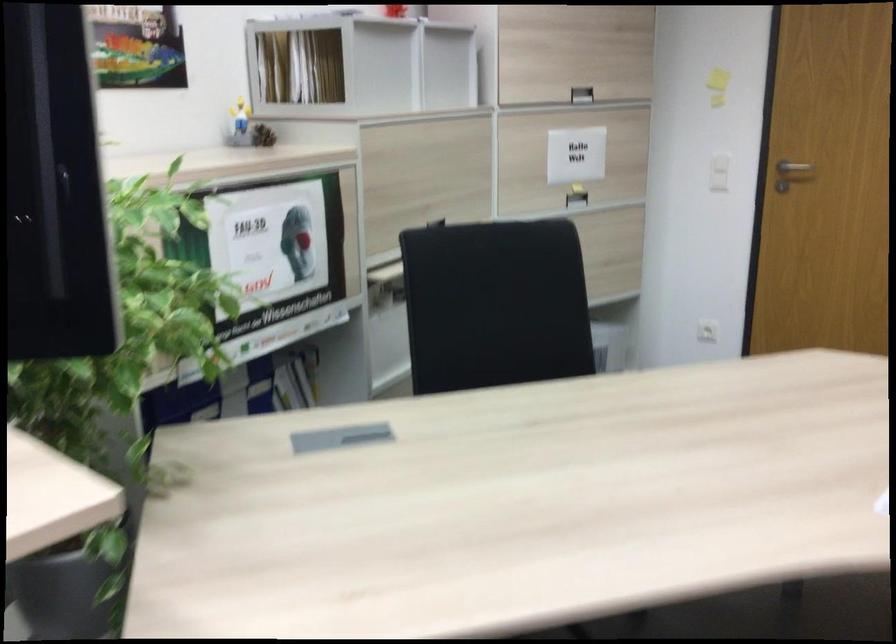
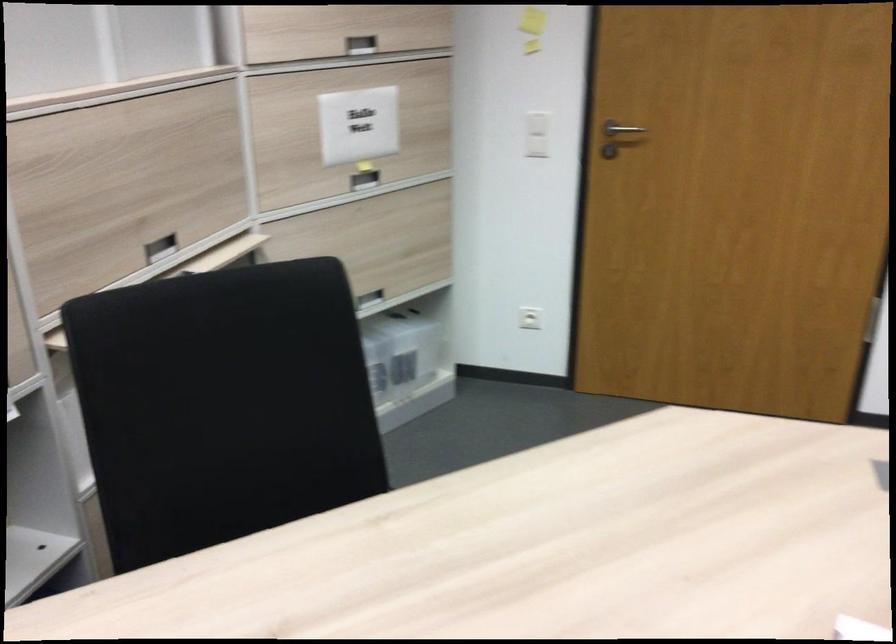
Question: I am providing you with two images of the same scene from different viewpoints. Please identify which objects are invisible in image2.

Choices:
 (A) plastic storage box
 (B) recessed cabinet handle
 (C) white light switch
 (D) none of these

Answer: (D)